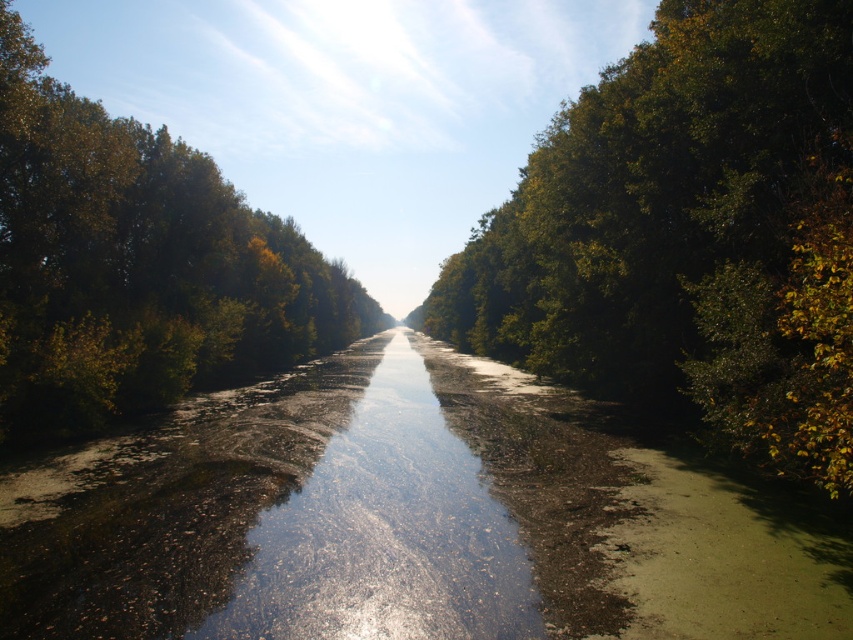
Question: Does green leafy tree at right have a smaller size compared to green leafy trees at left?

Choices:
 (A) no
 (B) yes

Answer: (B)

Question: Which object appears farthest from the camera in this image?

Choices:
 (A) green leafy tree at right
 (B) green leafy trees at left

Answer: (B)

Question: Which point is farther to the camera?

Choices:
 (A) (276, 292)
 (B) (686, 72)

Answer: (A)

Question: Is green leafy tree at right behind green leafy trees at left?

Choices:
 (A) yes
 (B) no

Answer: (B)

Question: Which point is closer to the camera taking this photo?

Choices:
 (A) (717, 392)
 (B) (131, 163)

Answer: (A)

Question: In this image, where is green leafy tree at right located relative to green leafy trees at left?

Choices:
 (A) left
 (B) right

Answer: (B)